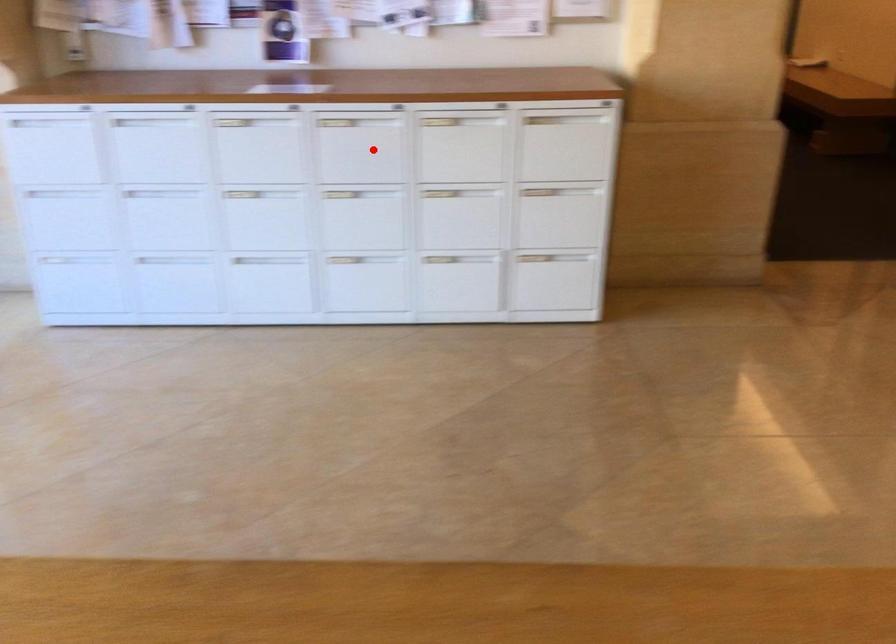
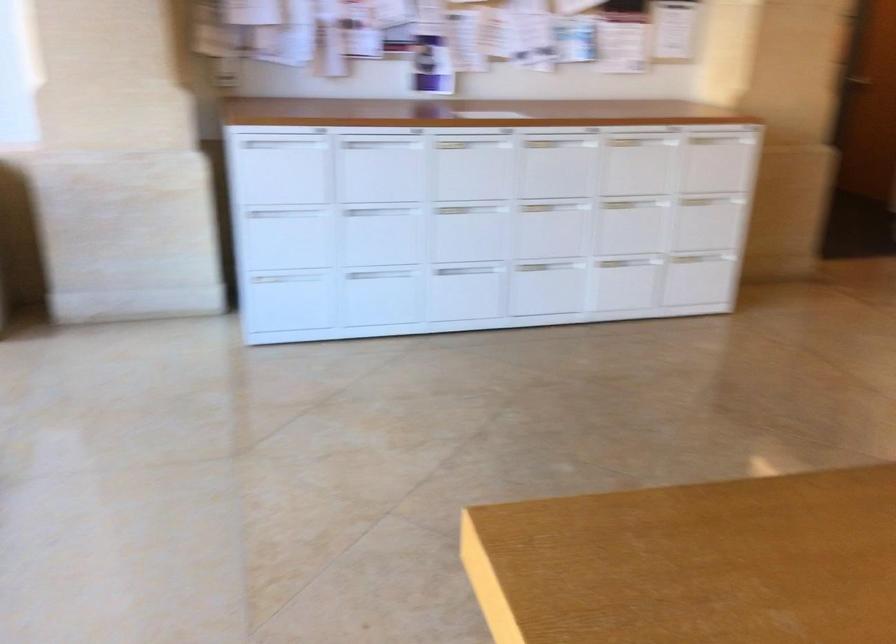
Question: I am providing you with two images of the same scene from different viewpoints. Image1 has a red point marked. In image2, the corresponding 3D location appears at what relative position? Reply with the corresponding letter.

Choices:
 (A) Closer
 (B) Farther

Answer: (B)